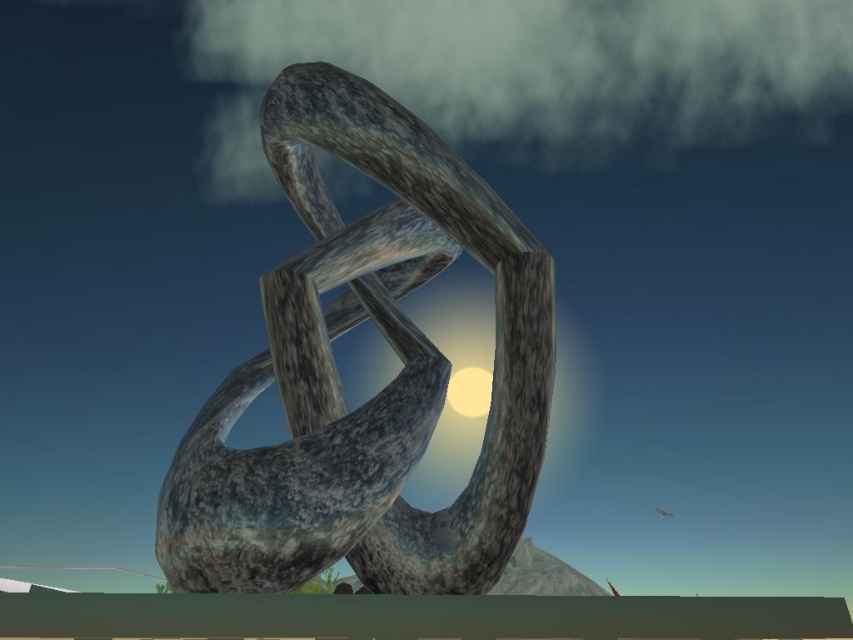
Is rustic stone sculpture at center thinner than matte gray sphere at center?

No, rustic stone sculpture at center is not thinner than matte gray sphere at center.

Does rustic stone sculpture at center lie behind matte gray sphere at center?

No, rustic stone sculpture at center is in front of matte gray sphere at center.

Does point (496, 538) come in front of point (463, 374)?

That is True.

This screenshot has width=853, height=640. I want to click on rustic stone sculpture at center, so click(381, 388).